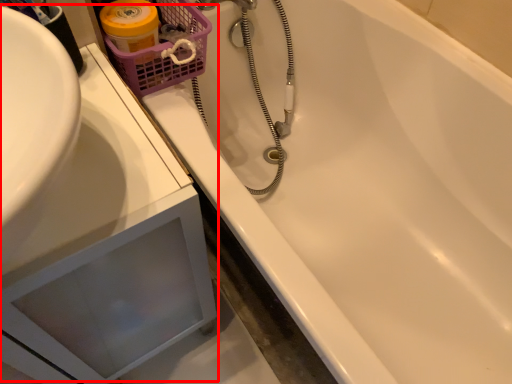
Question: From the image's perspective, where is sink (annotated by the red box) located relative to basket?

Choices:
 (A) below
 (B) above

Answer: (A)